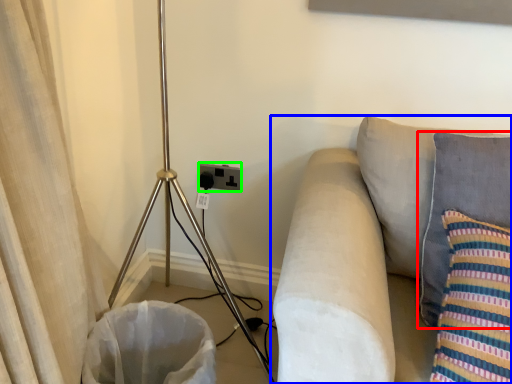
Question: Based on their relative distances, which object is nearer to pillow (highlighted by a red box)? Choose from studio couch (highlighted by a blue box) and electric outlet (highlighted by a green box).

Choices:
 (A) studio couch
 (B) electric outlet

Answer: (A)